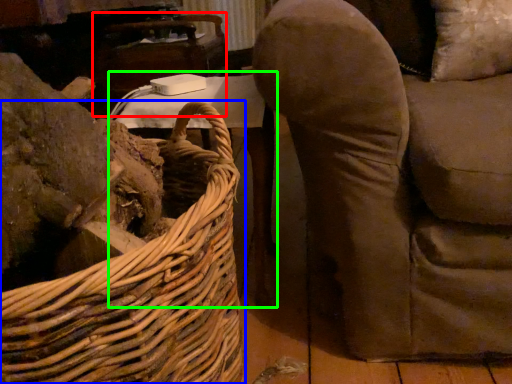
Question: Which object is positioned closest to table (highlighted by a red box)? Select from picnic basket (highlighted by a blue box) and table (highlighted by a green box).

Choices:
 (A) picnic basket
 (B) table

Answer: (B)